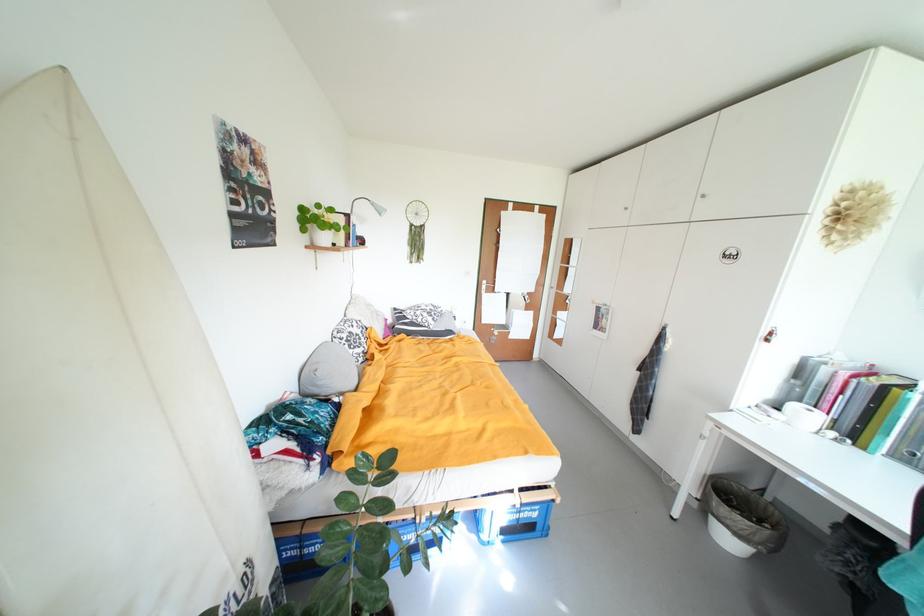
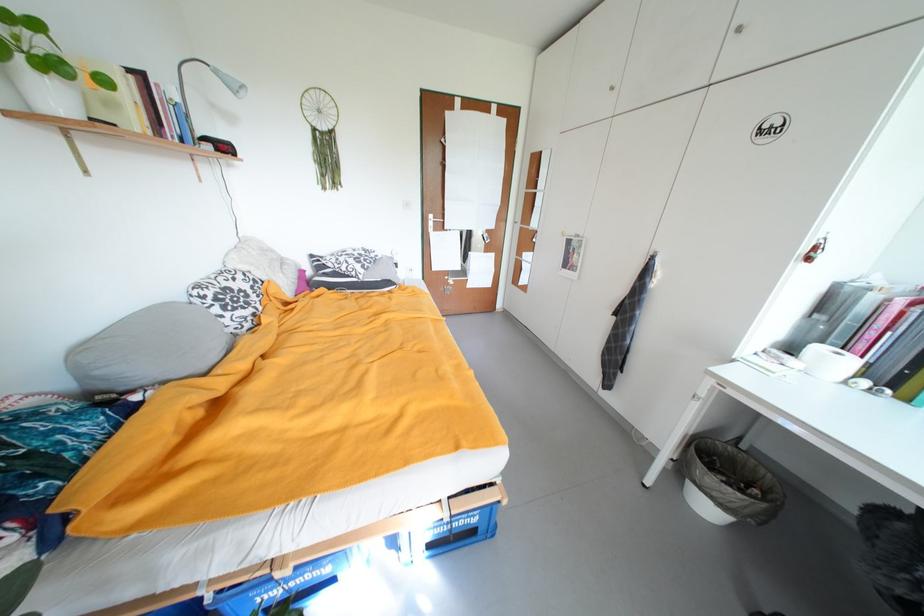
Where in the second image is the point corresponding to point 543,517 from the first image?

(482, 522)